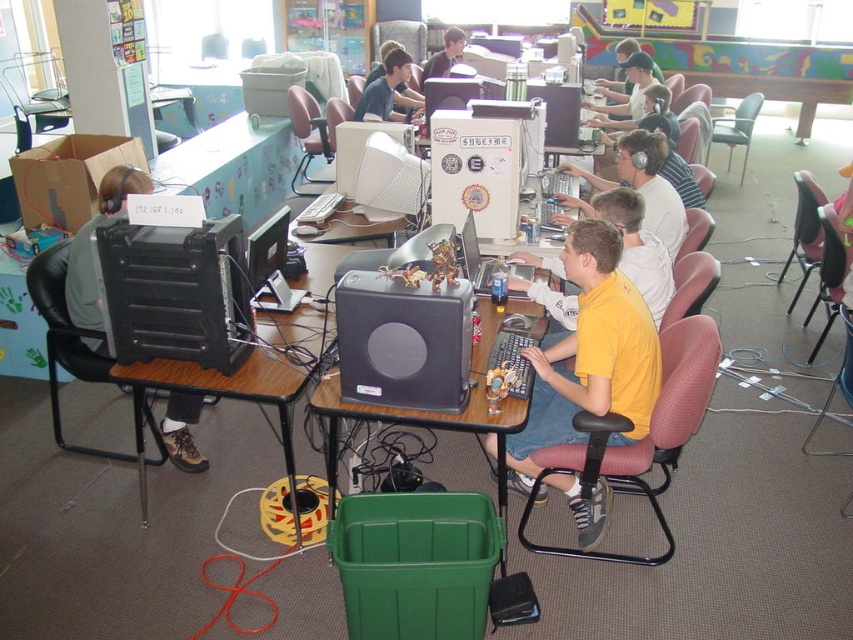
Is point (572, 435) farther from viewer compared to point (468, 232)?

No, (572, 435) is in front of (468, 232).

Between point (550, 472) and point (486, 260), which one is positioned behind?

The point (486, 260) is behind.

This screenshot has width=853, height=640. Identify the location of yellow matte shirt at center. (590, 355).

Can you confirm if black plastic desktop at left is taller than matte black computer at left?

No.

Based on the photo, is the position of black plastic desktop at left more distant than that of matte black computer at left?

No, it is not.

Does point (206, 259) come closer to viewer compared to point (175, 432)?

Yes, it is in front of point (175, 432).

Locate an element on the screen. black plastic desktop at left is located at coordinates (177, 292).

Does matte black computer at left appear under matte black laptop at upper center?

Yes, matte black computer at left is below matte black laptop at upper center.

Is point (189, 404) less distant than point (398, 48)?

Yes.

The height and width of the screenshot is (640, 853). I want to click on matte black computer at left, so click(x=93, y=248).